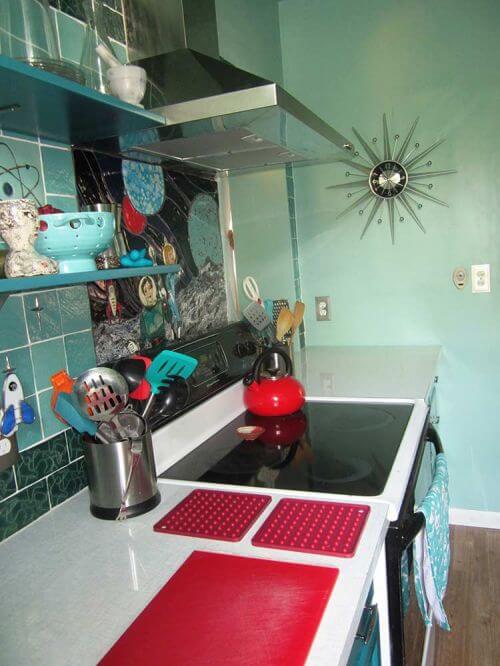
Where is `shelves`? The image size is (500, 666). shelves is located at coordinates (71, 127), (76, 276).